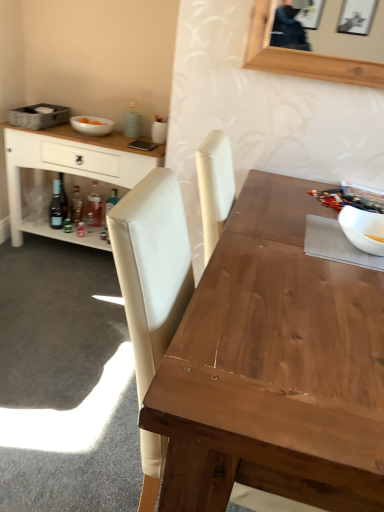
Question: In terms of width, does translucent glass bottle at lower left, which appears as the 3th bottle when viewed from the left, look wider or thinner when compared to translucent glass bottle at lower left, the second bottle viewed from the right?

Choices:
 (A) thin
 (B) wide

Answer: (A)

Question: Considering the positions of translucent glass bottle at lower left, which appears as the 3th bottle when viewed from the left, and translucent glass bottle at lower left, the second bottle viewed from the right, in the image, is translucent glass bottle at lower left, which appears as the 3th bottle when viewed from the left, bigger or smaller than translucent glass bottle at lower left, the second bottle viewed from the right,?

Choices:
 (A) big
 (B) small

Answer: (A)

Question: Which object is the farthest from the translucent glass bottle at lower left, which appears as the 3th bottle when viewed from the left?

Choices:
 (A) wooden table at center
 (B) white glossy bowl at upper left, arranged as the 1th bowl when viewed from the back
 (C) translucent glass bottle at lower left, the second bottle viewed from the right
 (D) gray woven picnic basket at upper left
 (E) white glossy bowl at upper right, which is the first bowl from front to back

Answer: (A)

Question: Estimate the real-world distances between objects in this image. Which object is farther from the white wood cabinet at left?

Choices:
 (A) white glossy bowl at upper left, arranged as the 1th bowl when viewed from the back
 (B) translucent glass bottle at lower left, which appears as the 3th bottle when viewed from the left
 (C) wooden table at center
 (D) white glossy bowl at upper right, which is the first bowl from front to back
 (E) translucent glass bottle at lower left, marked as the second bottle in a left-to-right arrangement

Answer: (C)